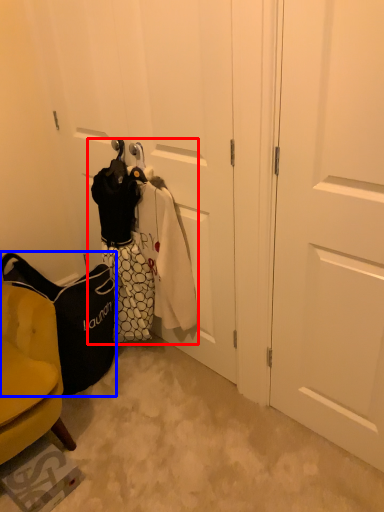
Question: Among these objects, which one is nearest to the camera, laundry (highlighted by a red box) or handbag (highlighted by a blue box)?

Choices:
 (A) laundry
 (B) handbag

Answer: (A)